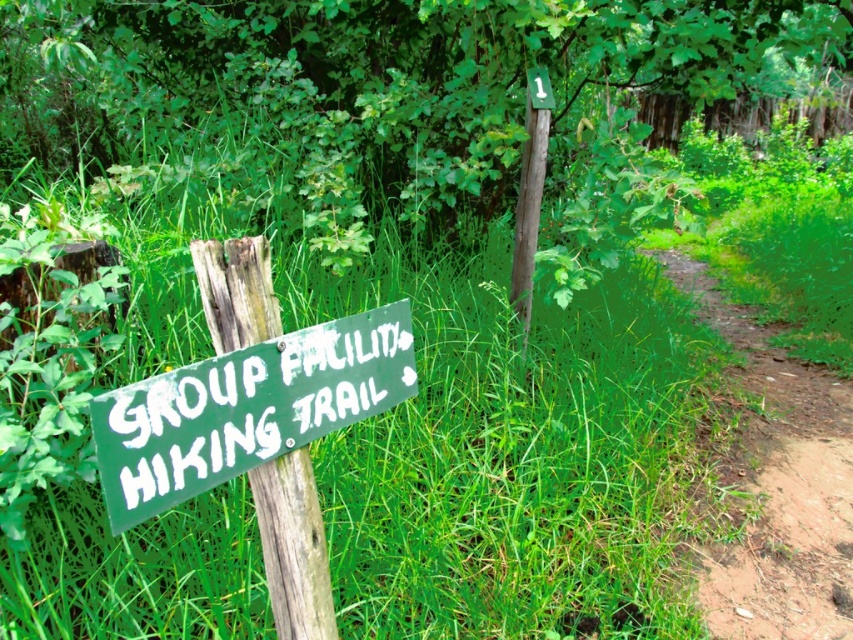
You are standing at the starting point of the hiking trail and see the green wood post at center. If you walk straight ahead, will you stay on the dirt path to the right of the post?

The green wood post at center is located at point [373,83]. Since the dirt path is to the right of the post, walking straight ahead from the starting point may not keep you on the path as the post is centered, so the path is offset to the right. Adjust your direction to head towards the right side of the post to stay on the path.